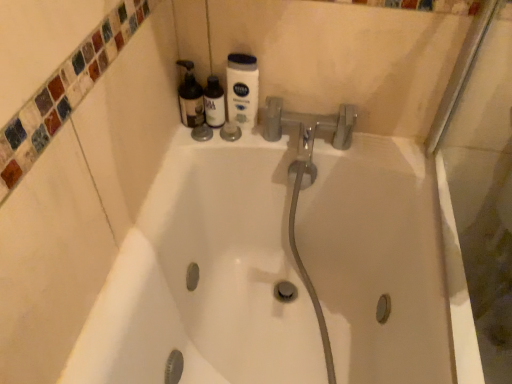
Question: From a real-world perspective, is translucent plastic bottles at upper left, the first cleaning product in the left-to-right sequence, positioned above or below translucent plastic bottle at upper center?

Choices:
 (A) below
 (B) above

Answer: (B)

Question: In terms of height, does translucent plastic bottles at upper left, marked as the 2th cleaning product in a right-to-left arrangement, look taller or shorter compared to translucent plastic bottle at upper center?

Choices:
 (A) short
 (B) tall

Answer: (B)

Question: Considering the real-world distances, which object is closest to the translucent plastic bottles at upper left, marked as the 2th cleaning product in a right-to-left arrangement?

Choices:
 (A) white matte nivea lotion at upper center, marked as the second cleaning product in a left-to-right arrangement
 (B) translucent plastic bottle at upper center

Answer: (B)

Question: Which object is the farthest from the translucent plastic bottle at upper center?

Choices:
 (A) white matte nivea lotion at upper center, marked as the 1th cleaning product in a right-to-left arrangement
 (B) translucent plastic bottles at upper left, marked as the 2th cleaning product in a right-to-left arrangement

Answer: (A)